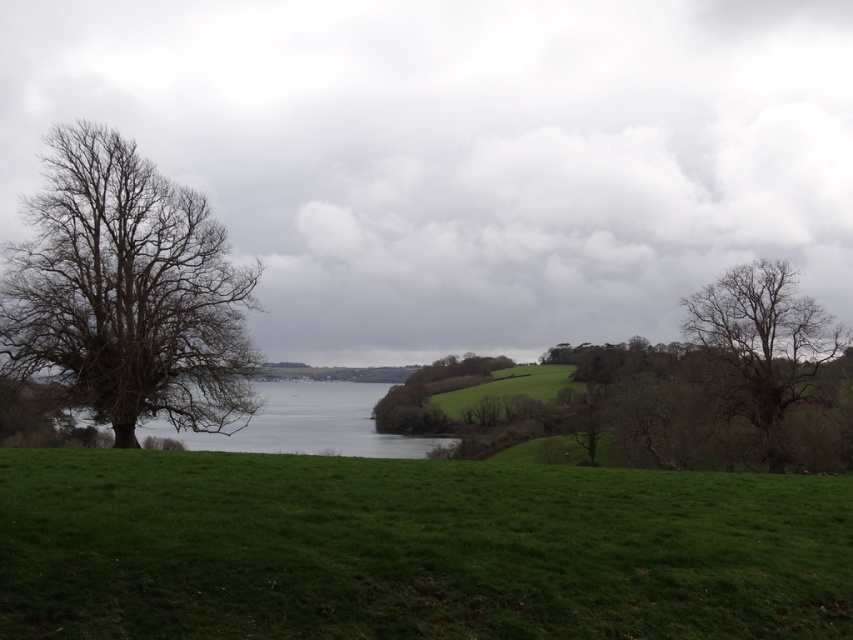
Question: Considering the relative positions of bare branches at left and bare branches tree at right in the image provided, where is bare branches at left located with respect to bare branches tree at right?

Choices:
 (A) below
 (B) above

Answer: (B)

Question: Estimate the real-world distances between objects in this image. Which object is closer to the green grassy field at lower center?

Choices:
 (A) bare branches at left
 (B) gray water at center

Answer: (A)

Question: Does bare branches at left appear on the left side of gray water at center?

Choices:
 (A) no
 (B) yes

Answer: (B)

Question: Can you confirm if green grassy field at lower center is bigger than bare branches at left?

Choices:
 (A) yes
 (B) no

Answer: (B)

Question: Which object is the closest to the bare branches tree at right?

Choices:
 (A) gray water at center
 (B) bare branches at left

Answer: (B)

Question: Which point appears closest to the camera in this image?

Choices:
 (A) click(70, 524)
 (B) click(373, 451)
 (C) click(714, 333)

Answer: (A)